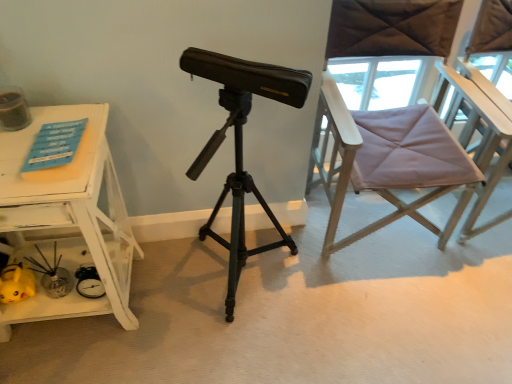
Find the location of a particular element. This screenshot has height=384, width=512. vacant location below matte black tripod at center (from a real-world perspective) is located at coordinates (250, 282).